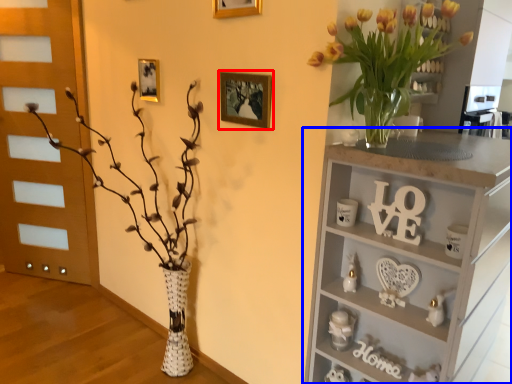
Question: Which point is further to the camera, picture frame (highlighted by a red box) or shelf (highlighted by a blue box)?

Choices:
 (A) picture frame
 (B) shelf

Answer: (A)